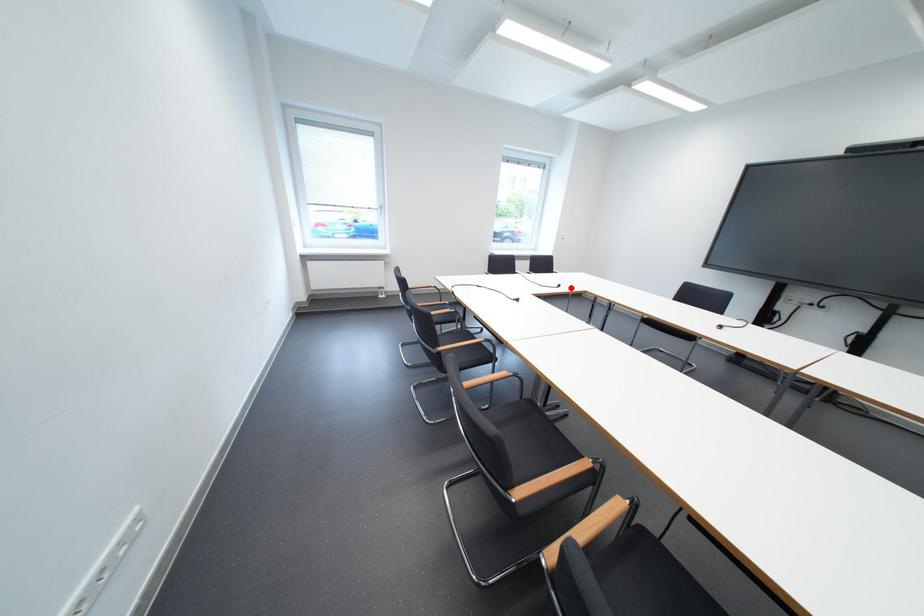
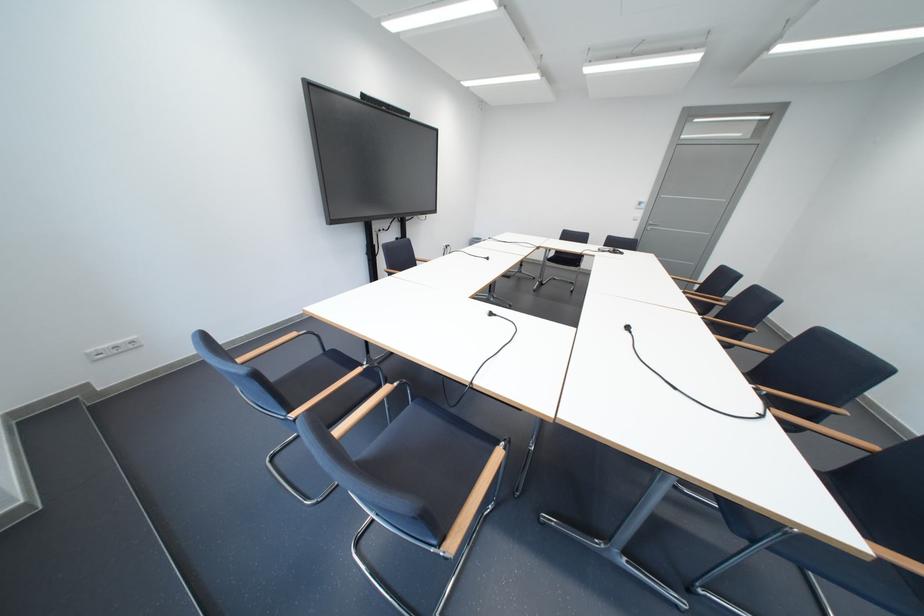
The point at the highlighted location is marked in the first image. Where is the corresponding point in the second image?

(503, 315)